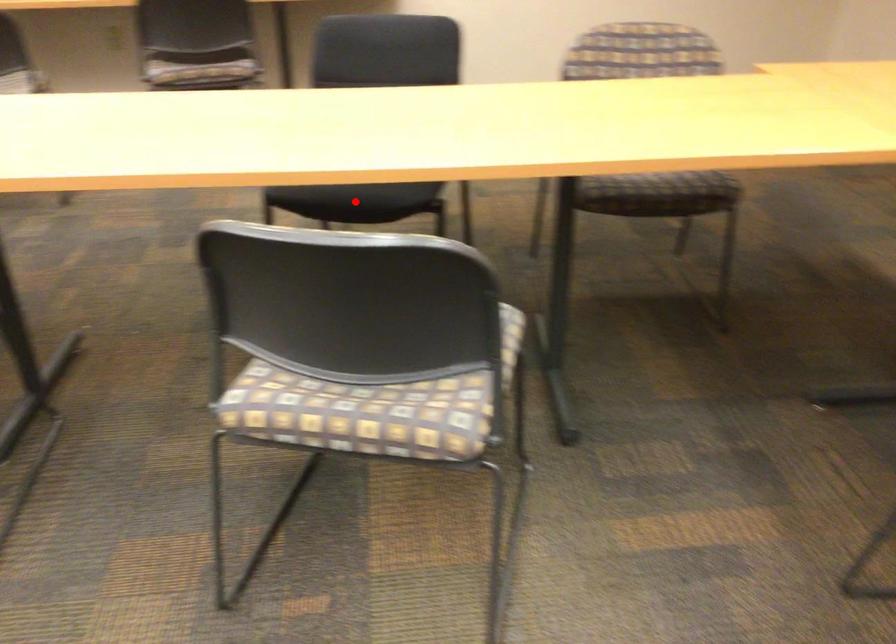
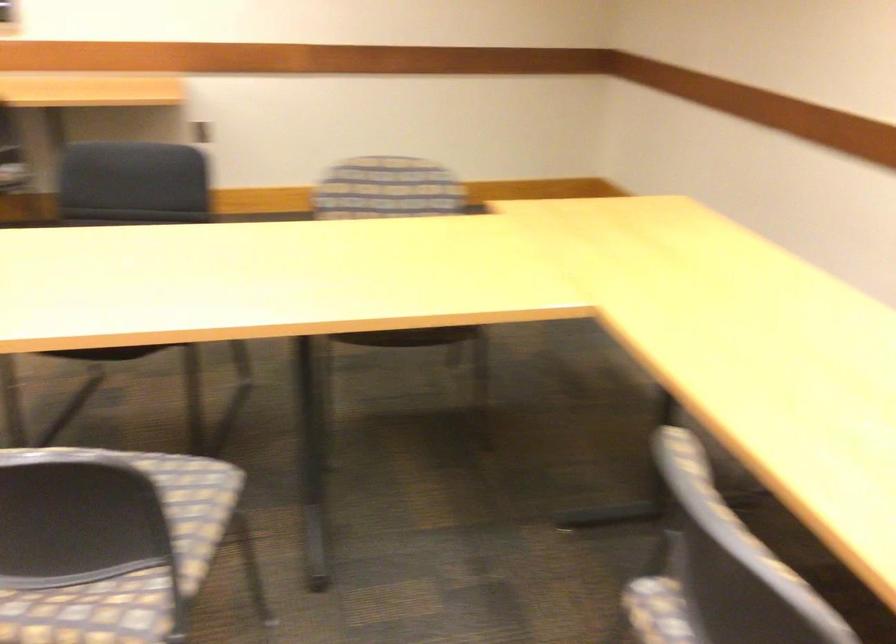
Question: I am providing you with two images of the same scene from different viewpoints. A red point is marked on the first image. Is the red point's position out of view in image 2?

Choices:
 (A) Yes
 (B) No

Answer: (A)